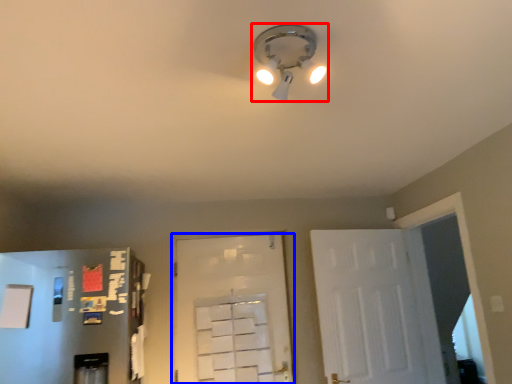
Question: Which object is closer to the camera taking this photo, lamp (highlighted by a red box) or door (highlighted by a blue box)?

Choices:
 (A) lamp
 (B) door

Answer: (A)